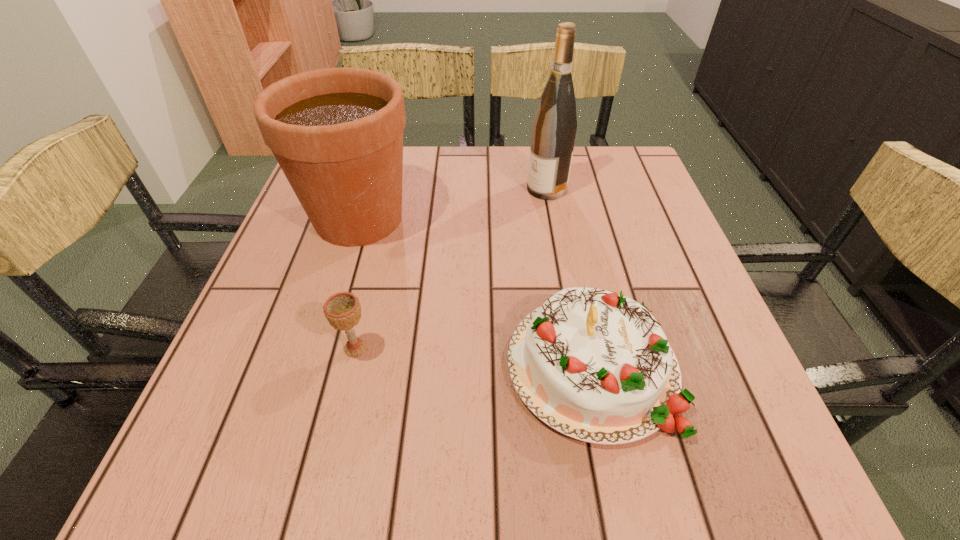
What are the coordinates of `wine bottle` in the screenshot? It's located at point(554,126).

Locate an element on the screen. The image size is (960, 540). flowerpot is located at coordinates (337, 133).

I want to click on cake, so click(595, 365).

Where is `the shortest object`? The image size is (960, 540). the shortest object is located at coordinates (342, 310).

I want to click on vacant space located 0.230m on the front of the tallest object, so click(x=561, y=266).

This screenshot has width=960, height=540. Identify the location of vacant position located on the right of the second tallest object. (502, 218).

Identify the location of free spot located 0.140m on the back of the cake. (568, 254).

This screenshot has width=960, height=540. Find the location of `vacant area situated 0.260m on the back of the chalice`. vacant area situated 0.260m on the back of the chalice is located at coordinates (381, 241).

Where is `wine bottle present at the far edge`? The width and height of the screenshot is (960, 540). wine bottle present at the far edge is located at coordinates 554,126.

The width and height of the screenshot is (960, 540). Find the location of `flowerpot that is at the far edge`. flowerpot that is at the far edge is located at coordinates (337, 133).